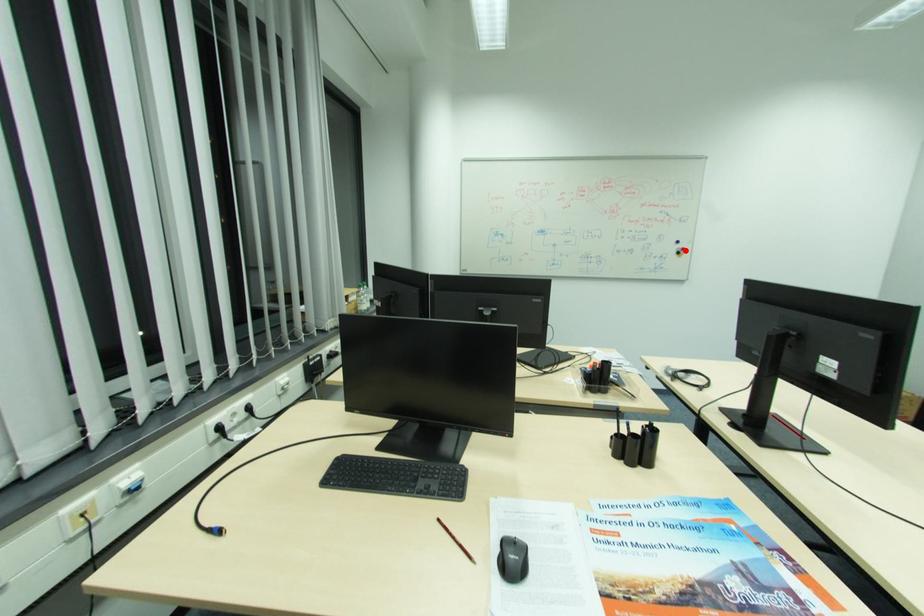
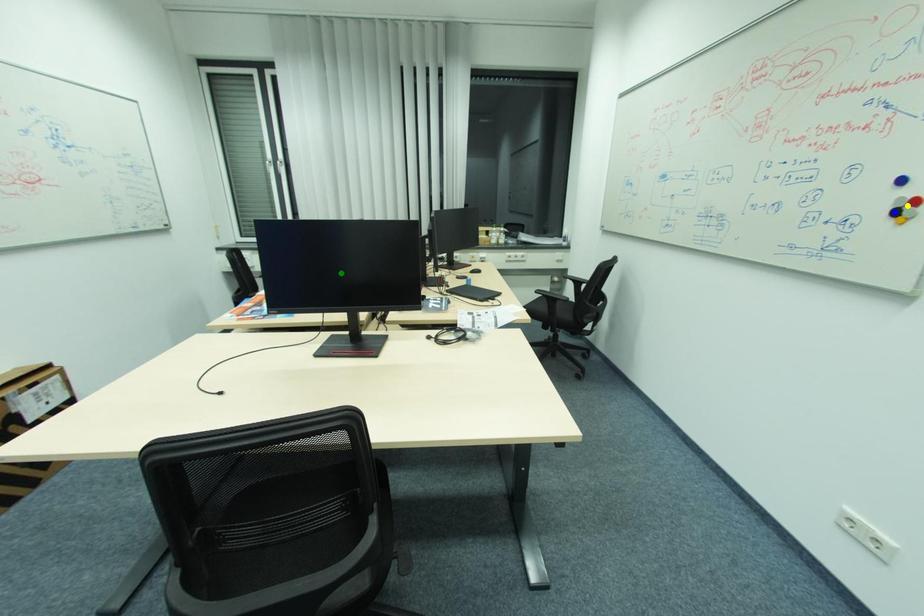
Question: I am providing you with two images of the same scene from different viewpoints. A red point is marked on the first image. You are given multiple points on the second image. Which mark in image 2 goes with the point in image 1?

Choices:
 (A) blue point
 (B) green point
 (C) yellow point

Answer: (C)